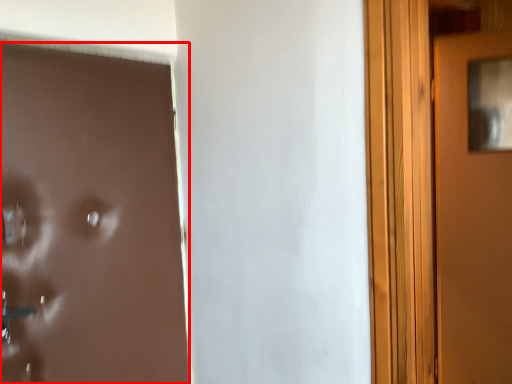
Question: From the image's perspective, what is the correct spatial positioning of door (annotated by the red box) in reference to door?

Choices:
 (A) above
 (B) below

Answer: (B)